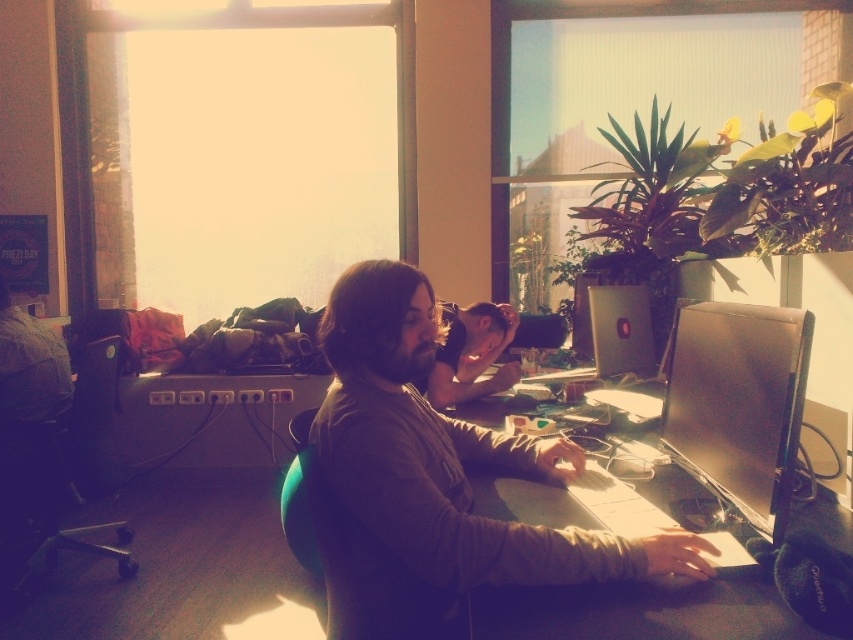
Can you confirm if matte brown shirt at center is positioned to the left of smooth wooden table at center?

Yes, matte brown shirt at center is to the left of smooth wooden table at center.

Between matte brown shirt at center and smooth wooden table at center, which one is positioned lower?

smooth wooden table at center

Does point (563, 563) come in front of point (569, 628)?

No, (563, 563) is further to viewer.

In order to click on matte brown shirt at center in this screenshot , I will do `click(432, 481)`.

Can you confirm if matte brown shirt at center is wider than matte black laptop at center?

Yes, matte brown shirt at center is wider than matte black laptop at center.

Is matte brown shirt at center bigger than matte black laptop at center?

Yes.

Is point (366, 538) less distant than point (447, 362)?

Yes, point (366, 538) is closer to viewer.

Identify the location of matte brown shirt at center. (432, 481).

Does smooth wooden table at center appear over black glossy monitor at center?

Incorrect, smooth wooden table at center is not positioned above black glossy monitor at center.

Between point (630, 586) and point (747, 502), which one is positioned behind?

Positioned behind is point (747, 502).

You are a GUI agent. You are given a task and a screenshot of the screen. Output one action in this format:
    pyautogui.click(x=<x>, y=<y>)
    Task: Click on the smooth wooden table at center
    The image size is (853, 640).
    Given the screenshot: What is the action you would take?
    pyautogui.click(x=642, y=612)